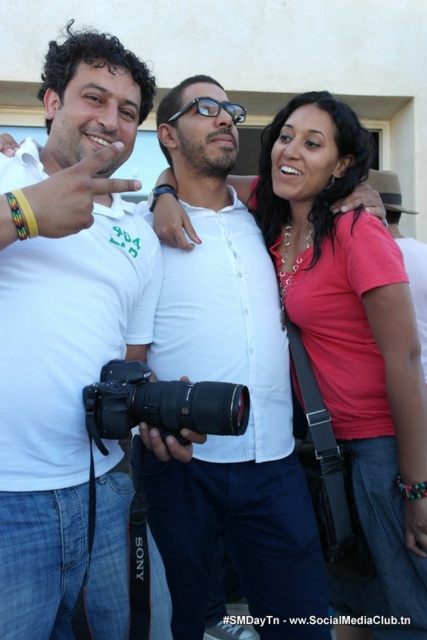
Question: Is white matte shirt at center further to the viewer compared to black plastic camera at center?

Choices:
 (A) yes
 (B) no

Answer: (B)

Question: Can you confirm if white matte shirt at center is thinner than matte pink shirt at center?

Choices:
 (A) yes
 (B) no

Answer: (A)

Question: Which point is closer to the camera?

Choices:
 (A) (108, 198)
 (B) (117, 417)

Answer: (B)

Question: Among these points, which one is farthest from the camera?

Choices:
 (A) (356, 604)
 (B) (35, 532)

Answer: (A)

Question: Which object is positioned closest to the black plastic camera at center?

Choices:
 (A) white matte shirt at center
 (B) matte pink shirt at center

Answer: (A)

Question: Can you confirm if white matte shirt at center is wider than black plastic camera at center?

Choices:
 (A) no
 (B) yes

Answer: (B)